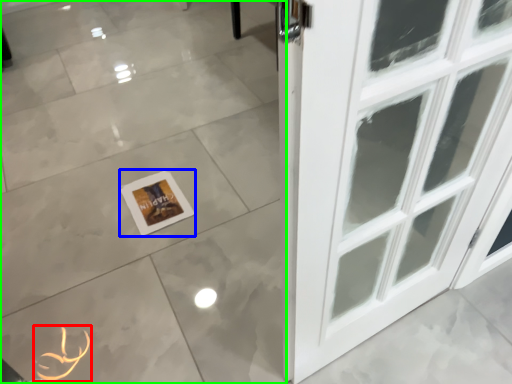
Question: Based on their relative distances, which object is nearer to print (highlighted by a red box)? Choose from picture frame (highlighted by a blue box) and ceramic tile (highlighted by a green box).

Choices:
 (A) picture frame
 (B) ceramic tile

Answer: (A)